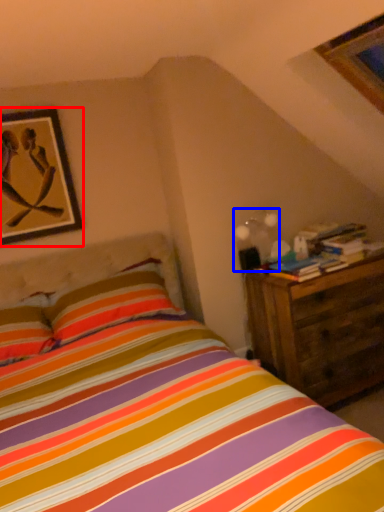
Question: Among these objects, which one is nearest to the camera, picture frame (highlighted by a red box) or light fixture (highlighted by a blue box)?

Choices:
 (A) picture frame
 (B) light fixture

Answer: (A)